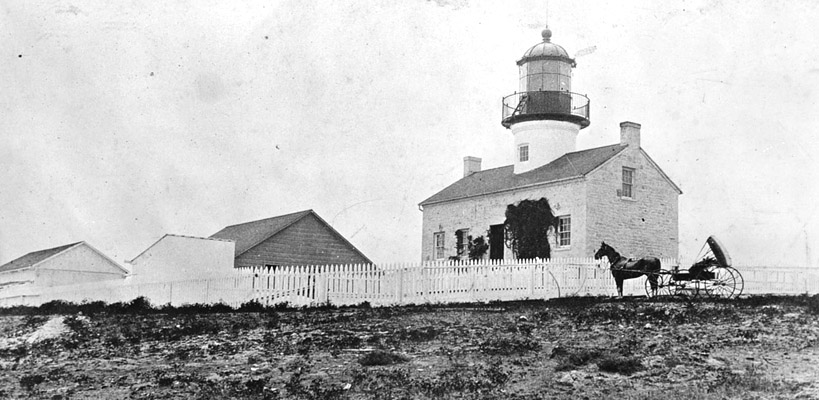
Where is `chimneys`? This screenshot has width=819, height=400. chimneys is located at coordinates (627, 137), (474, 163).